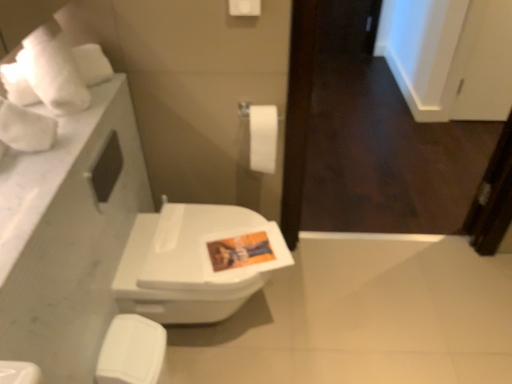
You are a GUI agent. You are given a task and a screenshot of the screen. Output one action in this format:
    pyautogui.click(x=<x>, y=<y>)
    Task: Click on the free space above white glossy toilet seat at lower left (from a real-world perspective)
    The image size is (512, 384).
    Given the screenshot: What is the action you would take?
    pyautogui.click(x=117, y=338)